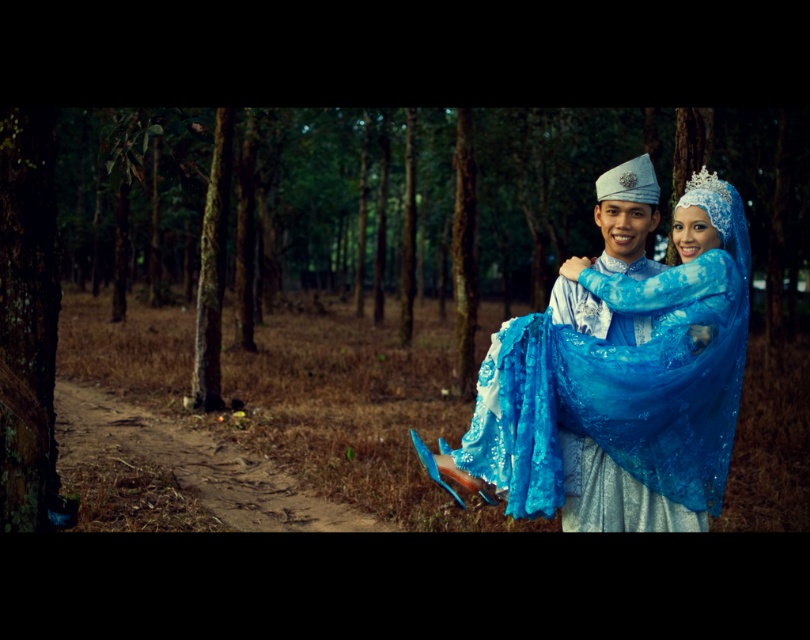
You are an artist planning to sketch this scene. You notice the green matte trees at center and the lustrous blue fabric dress at center. Which object should you draw first if you want to follow the rule of drawing larger objects before smaller ones?

The green matte trees at center should be drawn first because they are larger than the lustrous blue fabric dress at center according to the description.

Consider the image. What is the relationship between the width of the lustrous blue fabric dress at center and the lustrous blue fabric at center?

The lustrous blue fabric dress at center might be wider than lustrous blue fabric at center according to the description.